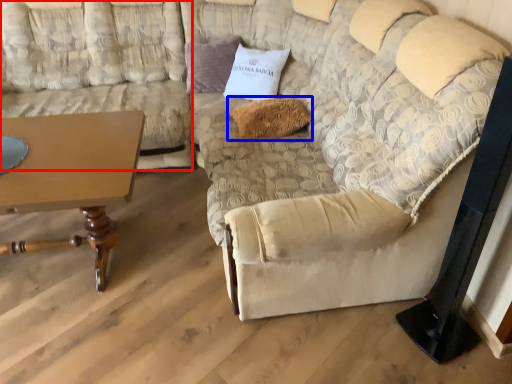
Question: Which object appears closest to the camera in this image, couch (highlighted by a red box) or pillow (highlighted by a blue box)?

Choices:
 (A) couch
 (B) pillow

Answer: (A)